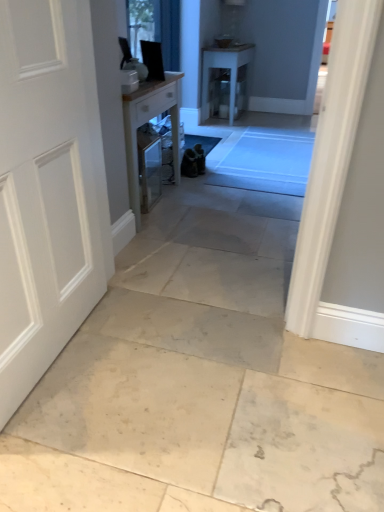
This screenshot has height=512, width=384. In order to click on free space in front of wooden table at center, which is counted as the first table, starting from the front in this screenshot , I will do `click(175, 245)`.